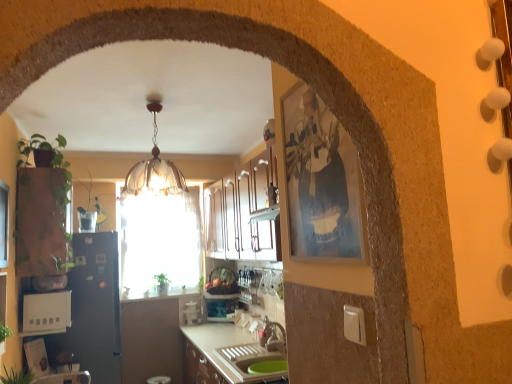
Question: Considering the relative sizes of white plastic toaster at lower left, which is counted as the 3th appliance, starting from the back, and black matte refrigerator at left, the 2th appliance positioned from the right, in the image provided, is white plastic toaster at lower left, which is counted as the 3th appliance, starting from the back, taller than black matte refrigerator at left, the 2th appliance positioned from the right,?

Choices:
 (A) no
 (B) yes

Answer: (A)

Question: From the image's perspective, would you say white plastic toaster at lower left, which is counted as the 1th appliance, starting from the front, is shown under black matte refrigerator at left, placed as the 2th appliance when sorted from front to back?

Choices:
 (A) yes
 (B) no

Answer: (B)

Question: Is white plastic toaster at lower left, which is counted as the 3th appliance, starting from the back, far away from black matte refrigerator at left, the 2th appliance viewed from the left?

Choices:
 (A) yes
 (B) no

Answer: (B)

Question: Does white plastic toaster at lower left, marked as the 3th appliance in a right-to-left arrangement, have a greater width compared to black matte refrigerator at left, the 2th appliance positioned from the right?

Choices:
 (A) yes
 (B) no

Answer: (B)

Question: Is white plastic toaster at lower left, which is counted as the 1th appliance, starting from the front, closer to camera compared to black matte refrigerator at left, which ranks as the 2th appliance in back-to-front order?

Choices:
 (A) no
 (B) yes

Answer: (B)

Question: From a real-world perspective, is white plastic toaster at lower left, marked as the 3th appliance in a right-to-left arrangement, on black matte refrigerator at left, the 2th appliance viewed from the left?

Choices:
 (A) no
 (B) yes

Answer: (B)

Question: Considering the relative positions of green leafy plant at left, which is the 2th plant in bottom-to-top order, and green leafy plant at center, acting as the third plant starting from the front, in the image provided, is green leafy plant at left, which is the 2th plant in bottom-to-top order, to the right of green leafy plant at center, acting as the third plant starting from the front, from the viewer's perspective?

Choices:
 (A) yes
 (B) no

Answer: (B)

Question: Considering the relative sizes of green leafy plant at left, which is the 2th plant in bottom-to-top order, and green leafy plant at center, positioned as the first plant in back-to-front order, in the image provided, is green leafy plant at left, which is the 2th plant in bottom-to-top order, taller than green leafy plant at center, positioned as the first plant in back-to-front order,?

Choices:
 (A) no
 (B) yes

Answer: (A)

Question: From the image's perspective, does green leafy plant at left, which is the second plant from left to right, appear lower than green leafy plant at center, the first plant when ordered from right to left?

Choices:
 (A) no
 (B) yes

Answer: (A)

Question: From the image's perspective, is green leafy plant at left, which is the second plant from left to right, above green leafy plant at center, positioned as the first plant in back-to-front order?

Choices:
 (A) yes
 (B) no

Answer: (A)

Question: Considering the relative sizes of green leafy plant at left, the 2th plant when ordered from top to bottom, and green leafy plant at center, the first plant when ordered from right to left, in the image provided, is green leafy plant at left, the 2th plant when ordered from top to bottom, smaller than green leafy plant at center, the first plant when ordered from right to left,?

Choices:
 (A) yes
 (B) no

Answer: (A)

Question: Could you tell me if green leafy plant at left, which is the second plant from left to right, is facing green leafy plant at center, the first plant when ordered from right to left?

Choices:
 (A) no
 (B) yes

Answer: (A)

Question: Does green matte plant at left, which ranks as the third plant in bottom-to-top order, have a larger size compared to black matte refrigerator at left, the 2th appliance positioned from the right?

Choices:
 (A) no
 (B) yes

Answer: (A)